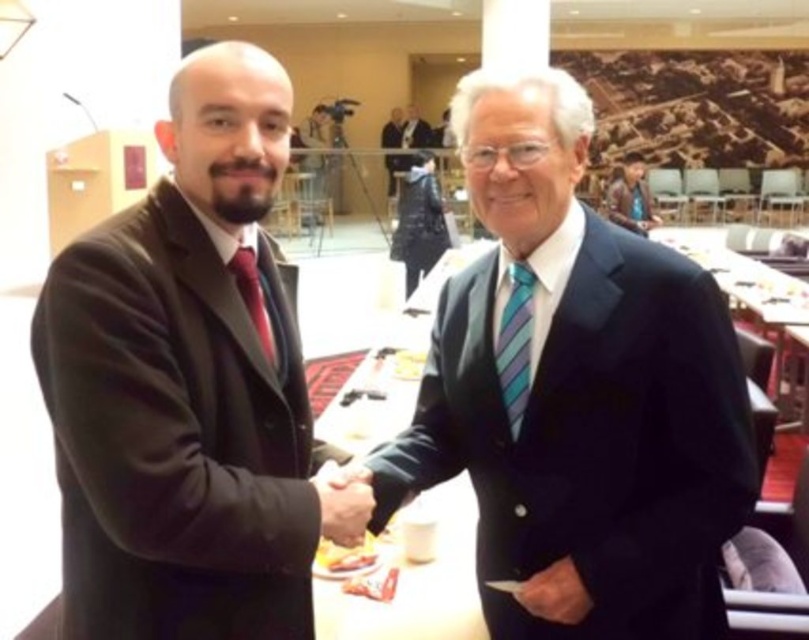
Between matte black suit at center and dark blue suit at center, which one is positioned lower?

matte black suit at center

Locate an element on the screen. The width and height of the screenshot is (809, 640). matte black suit at center is located at coordinates (578, 388).

Which of these two, matte black hand at center or smooth leather hand at center, stands shorter?

smooth leather hand at center

Is point (345, 472) positioned behind point (579, 602)?

Yes, it is behind point (579, 602).

Is point (327, 477) farther from camera compared to point (558, 612)?

Yes, it is.

The width and height of the screenshot is (809, 640). In order to click on matte black hand at center in this screenshot , I will do pyautogui.click(x=342, y=502).

Is the position of matte black suit at left more distant than that of smooth leather hand at center?

That is False.

Between matte black suit at left and smooth leather hand at center, which one is positioned higher?

matte black suit at left is higher up.

Find the location of a particular element. This screenshot has height=640, width=809. matte black suit at left is located at coordinates (184, 385).

At what (x,y) coordinates should I click in order to perform the action: click on matte black suit at left. Please return your answer as a coordinate pair (x, y). Looking at the image, I should click on (184, 385).